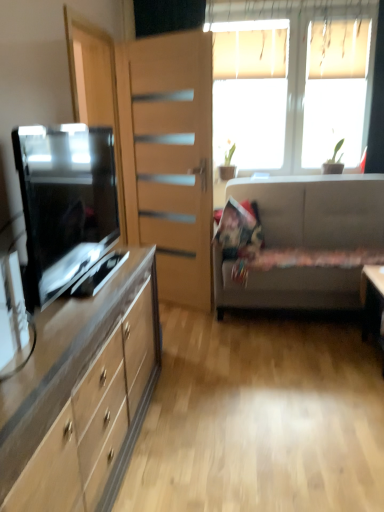
Question: Does white plastic window at upper right have a lesser width compared to fluffy fabric pillow at center?

Choices:
 (A) no
 (B) yes

Answer: (B)

Question: Is white plastic window at upper right bigger than fluffy fabric pillow at center?

Choices:
 (A) no
 (B) yes

Answer: (B)

Question: From the image's perspective, is white plastic window at upper right on fluffy fabric pillow at center?

Choices:
 (A) no
 (B) yes

Answer: (B)

Question: Does white plastic window at upper right lie behind fluffy fabric pillow at center?

Choices:
 (A) no
 (B) yes

Answer: (B)

Question: Is white plastic window at upper right not near fluffy fabric pillow at center?

Choices:
 (A) yes
 (B) no

Answer: (A)

Question: From a real-world perspective, is white plastic window at upper right positioned above or below white fabric couch at right?

Choices:
 (A) above
 (B) below

Answer: (A)

Question: Is white plastic window at upper right taller or shorter than white fabric couch at right?

Choices:
 (A) short
 (B) tall

Answer: (B)

Question: Considering the positions of white plastic window at upper right and white fabric couch at right in the image, is white plastic window at upper right bigger or smaller than white fabric couch at right?

Choices:
 (A) small
 (B) big

Answer: (A)

Question: In terms of width, does white plastic window at upper right look wider or thinner when compared to white fabric couch at right?

Choices:
 (A) wide
 (B) thin

Answer: (B)

Question: Considering their positions, is matte wood file cabinet at left located in front of or behind matte black tv at left?

Choices:
 (A) behind
 (B) front

Answer: (A)

Question: Is point (127, 173) closer or farther from the camera than point (64, 190)?

Choices:
 (A) closer
 (B) farther

Answer: (B)

Question: From the image's perspective, is matte wood file cabinet at left positioned above or below matte black tv at left?

Choices:
 (A) below
 (B) above

Answer: (B)

Question: Is matte wood file cabinet at left situated inside matte black tv at left or outside?

Choices:
 (A) outside
 (B) inside

Answer: (A)

Question: Is matte wood cabinet at left inside or outside of matte wood file cabinet at left?

Choices:
 (A) outside
 (B) inside

Answer: (A)

Question: From the image's perspective, is matte wood cabinet at left positioned above or below matte wood file cabinet at left?

Choices:
 (A) below
 (B) above

Answer: (A)